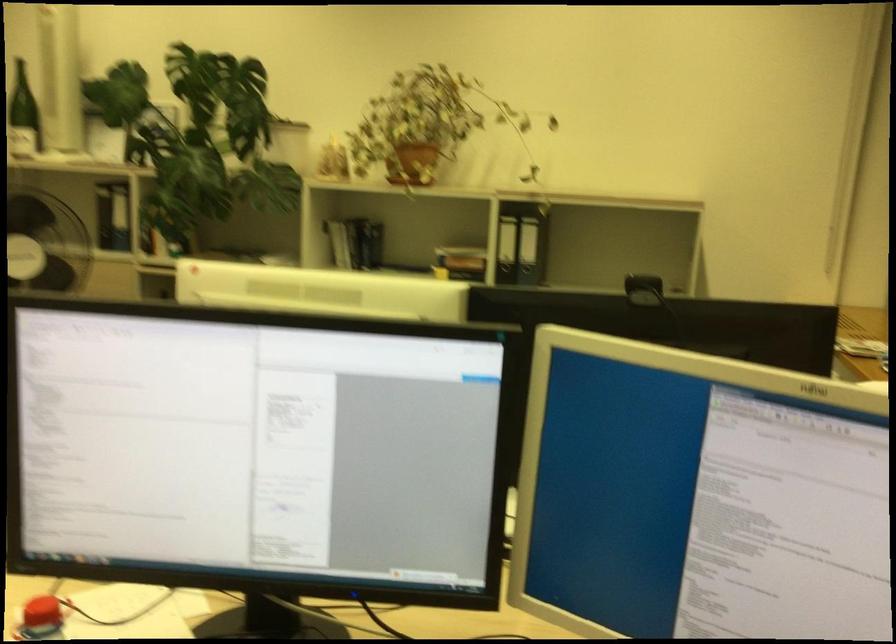
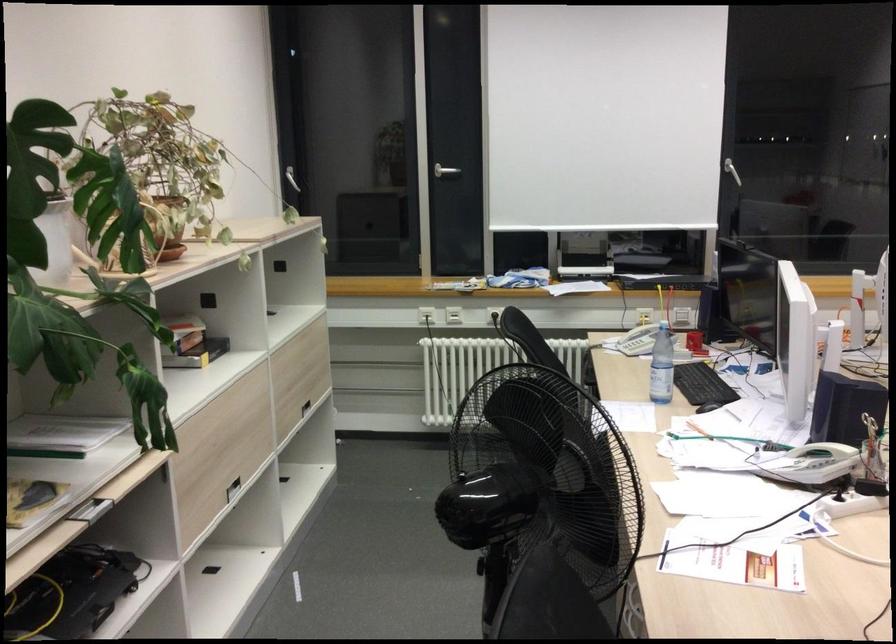
Find the pixel in the second image that matches [461,261] in the first image.

(192, 343)